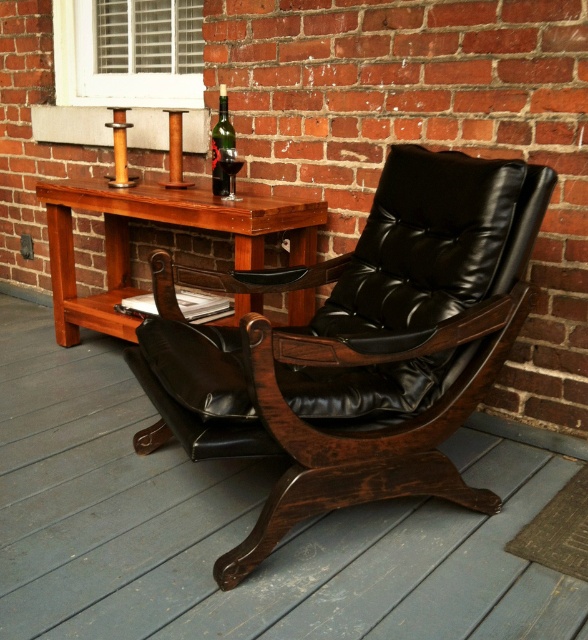
You are sitting in the black leather chair at center and want to reach the mahogany wood table at center. Which direction should you move to get closer to the table?

Since the black leather chair at center is closer to the viewer than the mahogany wood table at center, you should move forward to get closer to the table.

You are planning to place a 24 inch wide coffee table between the dark brown wood chair at center and the black leather chair at center. Will there be enough space for the table to fit between them?

The dark brown wood chair at center and the black leather chair at center are 20.20 inches apart from each other. Since the coffee table is 24 inches wide, it will not fit between them as the distance is smaller than the table width.